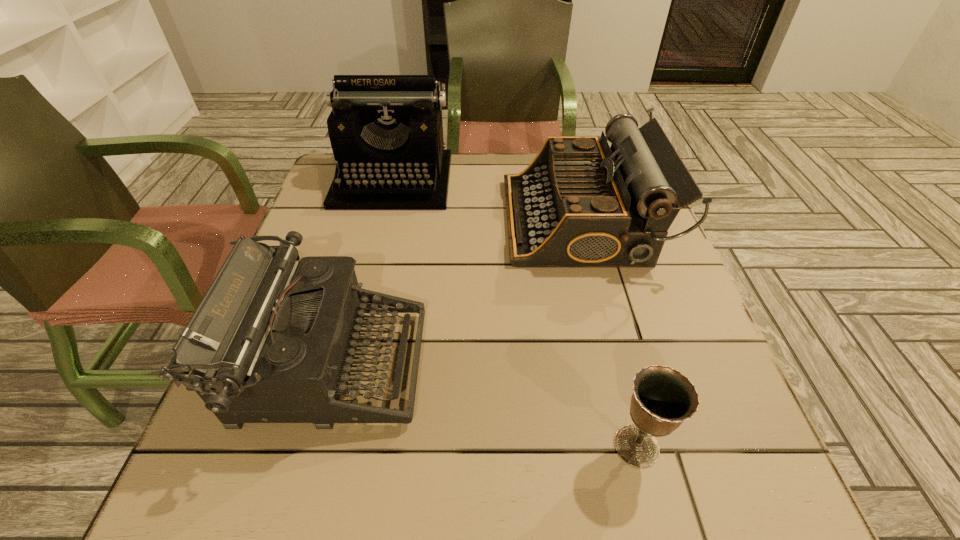
Locate an element on the screen. This screenshot has height=540, width=960. typewriter present at the near edge is located at coordinates (271, 341).

The width and height of the screenshot is (960, 540). I want to click on chalice that is at the near edge, so click(663, 398).

Where is `typewriter that is at the right edge`? typewriter that is at the right edge is located at coordinates (580, 204).

Where is `chalice at the right edge`? chalice at the right edge is located at coordinates (663, 398).

Where is `object present at the far left corner`? The image size is (960, 540). object present at the far left corner is located at coordinates (386, 132).

Locate an element on the screen. This screenshot has width=960, height=540. object at the near left corner is located at coordinates (271, 341).

Find the location of a particular element. object that is at the far right corner is located at coordinates pos(580,204).

At what (x,y) coordinates should I click in order to perform the action: click on object present at the near right corner. Please return your answer as a coordinate pair (x, y). This screenshot has width=960, height=540. Looking at the image, I should click on (663, 398).

The width and height of the screenshot is (960, 540). I want to click on blank area at the far edge, so click(504, 159).

Where is `blank area at the near edge`? This screenshot has height=540, width=960. blank area at the near edge is located at coordinates (490, 514).